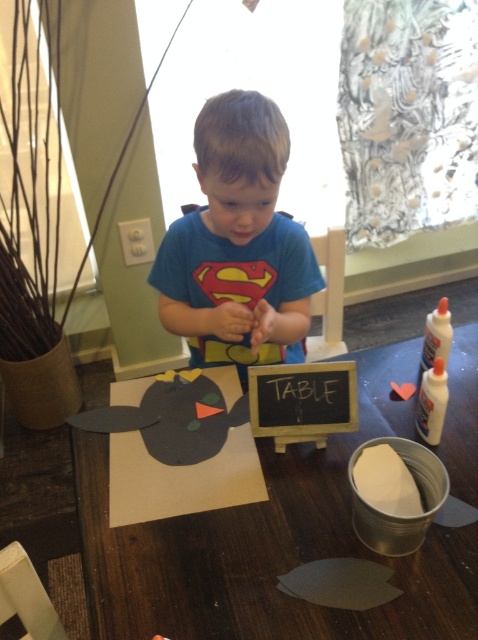
Who is shorter, matte cardboard table at center or blue cotton shirt at center?

matte cardboard table at center

Does matte cardboard table at center have a lesser width compared to blue cotton shirt at center?

In fact, matte cardboard table at center might be wider than blue cotton shirt at center.

This screenshot has width=478, height=640. What are the coordinates of `matte cardboard table at center` in the screenshot? It's located at (271, 545).

Identify the location of matte cardboard table at center. The width and height of the screenshot is (478, 640). (271, 545).